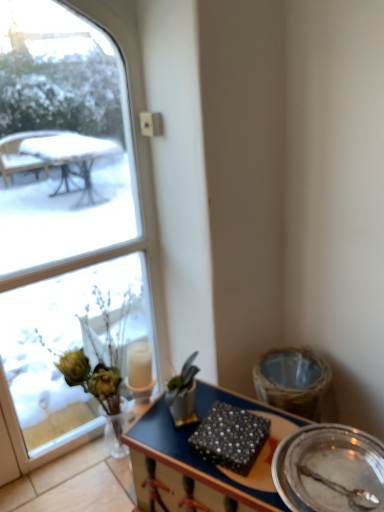
Question: Is metallic silver plate at lower right positioned with its back to clear glass window at upper left?

Choices:
 (A) no
 (B) yes

Answer: (A)

Question: Can you confirm if metallic silver plate at lower right is smaller than clear glass window at upper left?

Choices:
 (A) no
 (B) yes

Answer: (B)

Question: From the image's perspective, is metallic silver plate at lower right under clear glass window at upper left?

Choices:
 (A) no
 (B) yes

Answer: (B)

Question: Is metallic silver plate at lower right taller than clear glass window at upper left?

Choices:
 (A) no
 (B) yes

Answer: (A)

Question: Is metallic silver plate at lower right at the right side of clear glass window at upper left?

Choices:
 (A) no
 (B) yes

Answer: (B)

Question: Is metallic silver plate at lower right directly adjacent to clear glass window at upper left?

Choices:
 (A) yes
 (B) no

Answer: (B)

Question: Is wooden desk at center turned away from translucent glass vase at left?

Choices:
 (A) yes
 (B) no

Answer: (B)

Question: From a real-world perspective, is wooden desk at center located higher than translucent glass vase at left?

Choices:
 (A) no
 (B) yes

Answer: (A)

Question: Does wooden desk at center have a larger size compared to translucent glass vase at left?

Choices:
 (A) no
 (B) yes

Answer: (B)

Question: From the image's perspective, would you say wooden desk at center is shown under translucent glass vase at left?

Choices:
 (A) yes
 (B) no

Answer: (A)

Question: From a real-world perspective, is wooden desk at center below translucent glass vase at left?

Choices:
 (A) yes
 (B) no

Answer: (A)

Question: Does wooden desk at center have a greater height compared to translucent glass vase at left?

Choices:
 (A) yes
 (B) no

Answer: (B)

Question: Considering the relative sizes of metallic silver plate at lower right and pearl-patterned fabric at center in the image provided, is metallic silver plate at lower right shorter than pearl-patterned fabric at center?

Choices:
 (A) no
 (B) yes

Answer: (A)